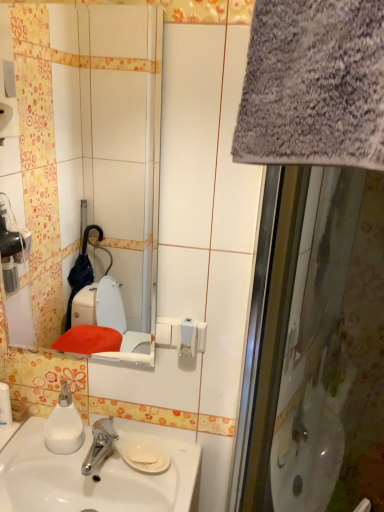
The height and width of the screenshot is (512, 384). What are the coordinates of `vacant region above white glossy sink at lower left (from a real-world perspective)` in the screenshot? It's located at (81, 438).